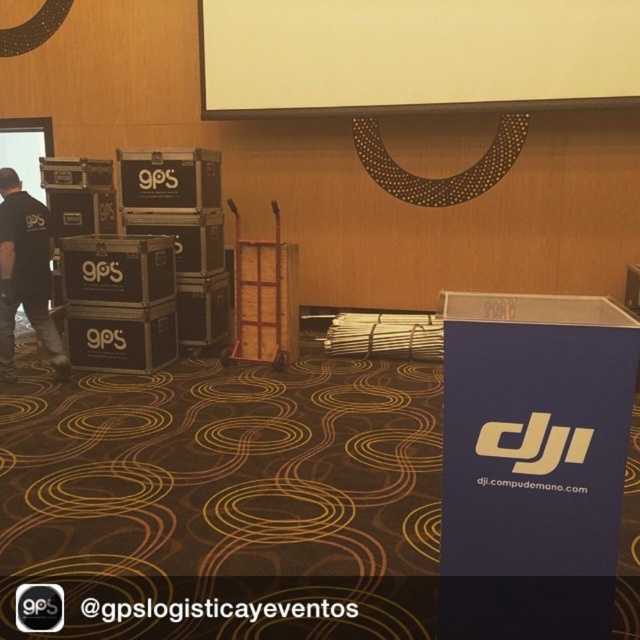
Question: Can you confirm if white matte projection screen at upper center is wider than black fabric shirt at left?

Choices:
 (A) yes
 (B) no

Answer: (A)

Question: Can you confirm if white matte projection screen at upper center is positioned below black fabric shirt at left?

Choices:
 (A) no
 (B) yes

Answer: (A)

Question: Does white matte projection screen at upper center come behind black fabric shirt at left?

Choices:
 (A) no
 (B) yes

Answer: (B)